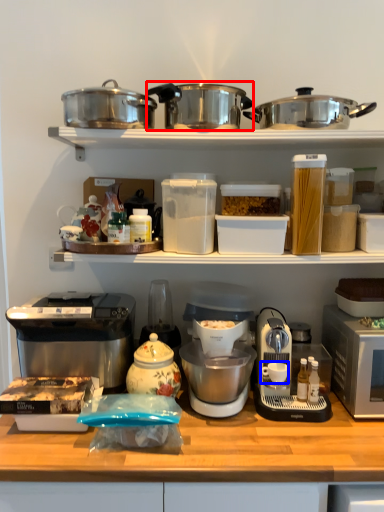
Question: Which object appears farthest to the camera in this image, kitchen appliance (highlighted by a red box) or coffee cup (highlighted by a blue box)?

Choices:
 (A) kitchen appliance
 (B) coffee cup

Answer: (B)